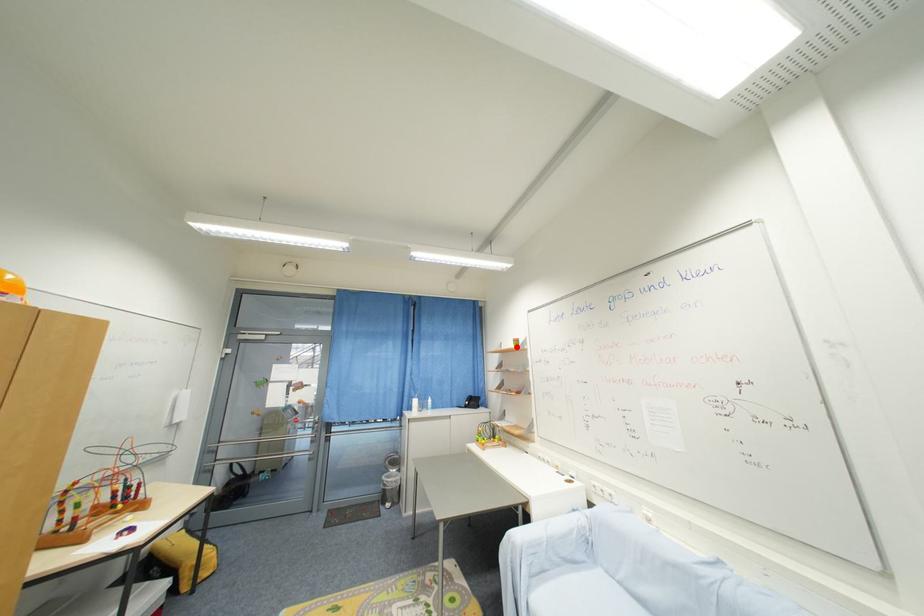
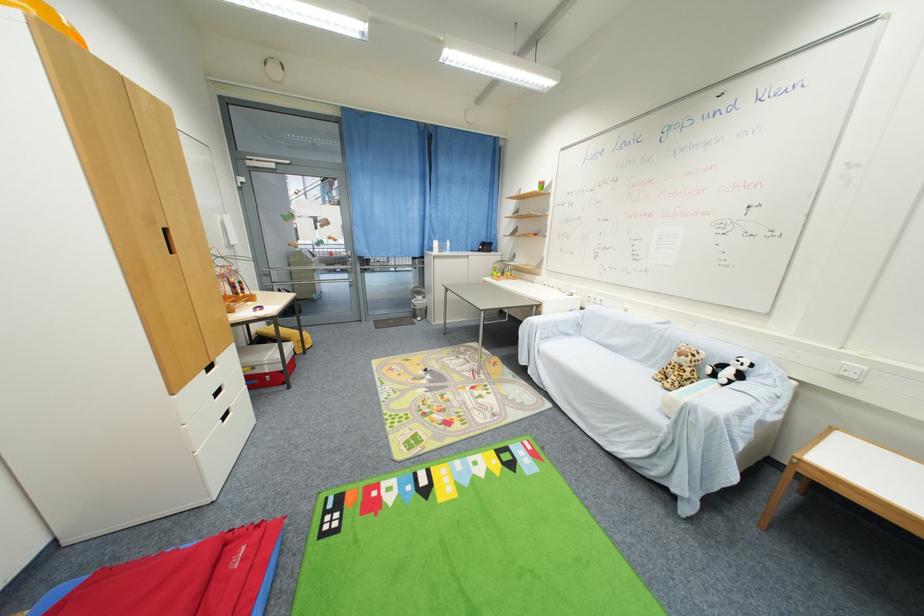
Question: I am providing you with two images of the same scene from different viewpoints. Image1 has a red point marked. In image2, the corresponding 3D location appears at what relative position? Reply with the corresponding letter.

Choices:
 (A) Closer
 (B) Farther

Answer: (A)